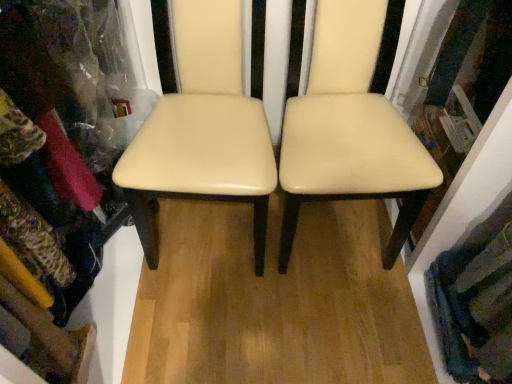
Question: Considering the relative sizes of textured wool scarf at lower right and creamy leather chair at center, the 1th chair from the right, in the image provided, is textured wool scarf at lower right taller than creamy leather chair at center, the 1th chair from the right,?

Choices:
 (A) no
 (B) yes

Answer: (A)

Question: Is textured wool scarf at lower right shorter than creamy leather chair at center, which ranks as the 2th chair in left-to-right order?

Choices:
 (A) no
 (B) yes

Answer: (B)

Question: Are textured wool scarf at lower right and creamy leather chair at center, the 1th chair from the right, far apart?

Choices:
 (A) no
 (B) yes

Answer: (A)

Question: From the image's perspective, is textured wool scarf at lower right located above creamy leather chair at center, the 1th chair from the right?

Choices:
 (A) yes
 (B) no

Answer: (B)

Question: Does textured wool scarf at lower right contain creamy leather chair at center, which ranks as the 2th chair in left-to-right order?

Choices:
 (A) yes
 (B) no

Answer: (B)

Question: Is textured wool scarf at lower right directly adjacent to creamy leather chair at center, which ranks as the 2th chair in left-to-right order?

Choices:
 (A) yes
 (B) no

Answer: (B)

Question: Does cream leather chair at center, which is counted as the 1th chair, starting from the left, touch textured wool scarf at lower right?

Choices:
 (A) yes
 (B) no

Answer: (B)

Question: From the image's perspective, is cream leather chair at center, which is counted as the 1th chair, starting from the left, located beneath textured wool scarf at lower right?

Choices:
 (A) no
 (B) yes

Answer: (A)

Question: Is cream leather chair at center, which is counted as the 1th chair, starting from the left, oriented away from textured wool scarf at lower right?

Choices:
 (A) no
 (B) yes

Answer: (A)

Question: Considering the relative positions of cream leather chair at center, which is counted as the 1th chair, starting from the left, and textured wool scarf at lower right in the image provided, is cream leather chair at center, which is counted as the 1th chair, starting from the left, to the left of textured wool scarf at lower right from the viewer's perspective?

Choices:
 (A) no
 (B) yes

Answer: (B)

Question: Is cream leather chair at center, placed as the second chair when sorted from right to left, further to the viewer compared to textured wool scarf at lower right?

Choices:
 (A) no
 (B) yes

Answer: (A)

Question: Does cream leather chair at center, placed as the second chair when sorted from right to left, have a lesser width compared to textured wool scarf at lower right?

Choices:
 (A) no
 (B) yes

Answer: (A)

Question: Does creamy leather chair at center, the 1th chair from the right, have a lesser height compared to cream leather chair at center, placed as the second chair when sorted from right to left?

Choices:
 (A) yes
 (B) no

Answer: (B)